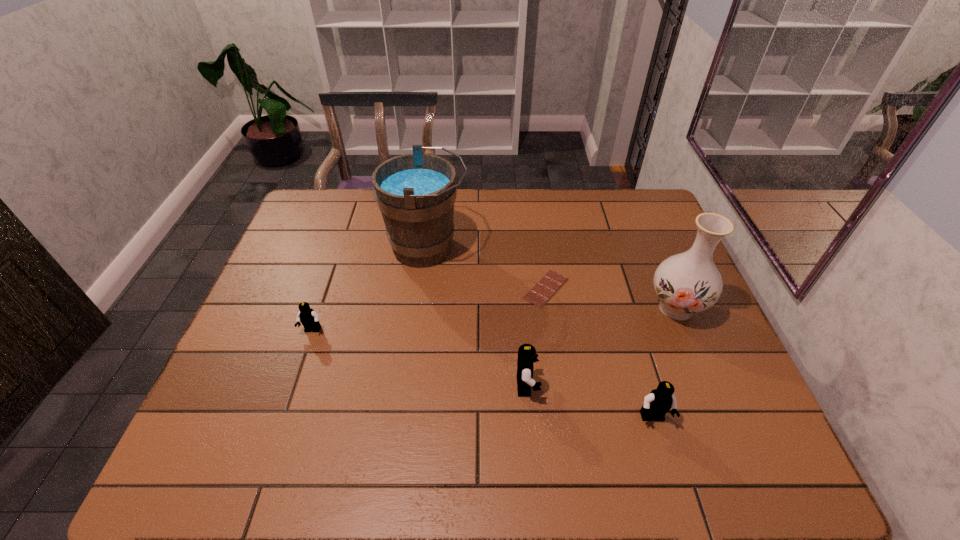
To achieve even spacing by inserting another Lego among them, please point to a vacant spot for this new Lego. Please provide its 2D coordinates. Your answer should be formatted as a tuple, i.e. [(x, y)], where the tuple contains the x and y coordinates of a point satisfying the conditions above.

[(414, 357)]